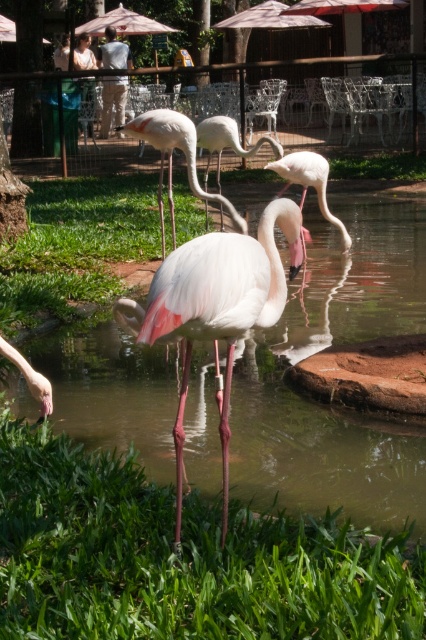
Question: Does white matte flamingo at center come in front of pink matte flamingo at center?

Choices:
 (A) no
 (B) yes

Answer: (B)

Question: Where is pink matte flamingo at center located in relation to pink feathered flamingo at center in the image?

Choices:
 (A) below
 (B) above

Answer: (A)

Question: Does pink matte flamingo at center have a lesser width compared to pink feathered flamingo at lower left?

Choices:
 (A) yes
 (B) no

Answer: (B)

Question: Which point appears farthest from the camera in this image?

Choices:
 (A) coord(66,394)
 (B) coord(279,154)
 (C) coord(126,125)
 (D) coord(227,264)

Answer: (B)

Question: Which object is the closest to the pink glossy water at center?

Choices:
 (A) pink feathered flamingo at lower left
 (B) white matte flamingo at center

Answer: (A)

Question: Among these objects, which one is nearest to the camera?

Choices:
 (A) pink glossy water at center
 (B) matte pink flamingo at center
 (C) white matte flamingo at center
 (D) pink matte flamingo at center

Answer: (B)